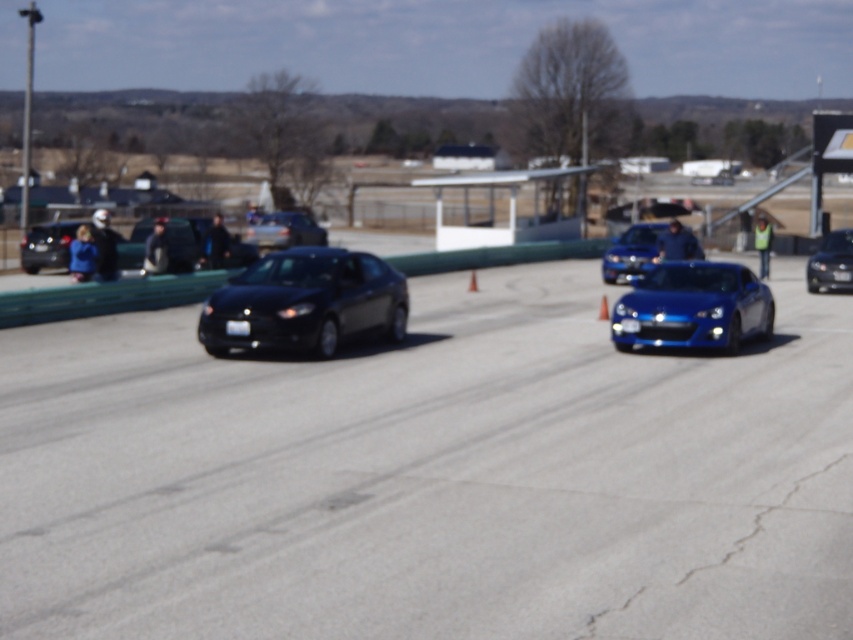
You are a race car driver preparing for a turn. You see the smooth asphalt road at center and the shiny metallic sports car at right. Which object is closer to you as you approach the turn?

The smooth asphalt road at center is closer to you because it is in front of the shiny metallic sports car at right, indicating it is nearer in your line of sight.

You are a race official observing the track. You notice the shiny metallic sports car at right and the glossy blue sports car at center. Which car is closer to the left edge of the track?

The shiny metallic sports car at right is positioned on the left side of the glossy blue sports car at center, so it is closer to the left edge of the track.

You are a drone operator trying to capture aerial footage of the smooth asphalt road at center and the shiny metallic sports car at right. Based on their relative sizes in the image, which object would appear larger in the camera frame?

The smooth asphalt road at center appears larger in the camera frame because it is taller than the shiny metallic sports car at right.